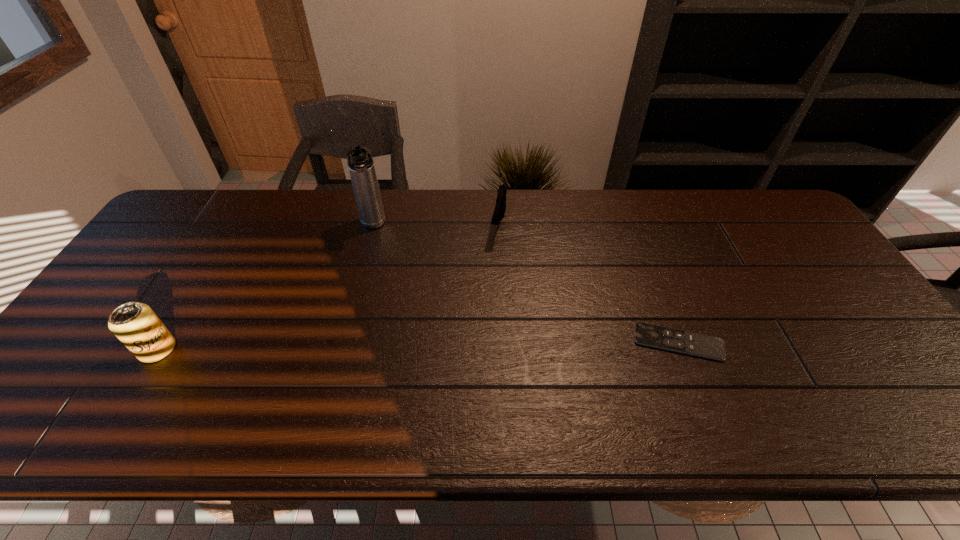
What are the coordinates of `vacant space located 0.120m on the front-facing side of the third object from left to right` in the screenshot? It's located at (492, 274).

Locate an element on the screen. vacant region located 0.100m on the front-facing side of the third object from left to right is located at coordinates (492, 269).

Image resolution: width=960 pixels, height=540 pixels. I want to click on free region located 0.120m on the front-facing side of the third object from left to right, so click(492, 274).

Where is `vacant position located 0.080m on the handle side of the tallest object`? The image size is (960, 540). vacant position located 0.080m on the handle side of the tallest object is located at coordinates point(375,254).

Identify the location of vacant space located 0.400m on the handle side of the tallest object. (388, 340).

You are a GUI agent. You are given a task and a screenshot of the screen. Output one action in this format:
    pyautogui.click(x=<x>, y=<y>)
    Task: Click on the vacant point located on the handle side of the tallest object
    
    Given the screenshot: What is the action you would take?
    pyautogui.click(x=386, y=330)

Find the location of a particular element. Image resolution: width=960 pixels, height=540 pixels. pistol that is at the far edge is located at coordinates 500,207.

Find the location of `thermos bottle that is at the far edge`. thermos bottle that is at the far edge is located at coordinates (361, 166).

You are a GUI agent. You are given a task and a screenshot of the screen. Output one action in this format:
    pyautogui.click(x=<x>, y=<y>)
    Task: Click on the object that is at the near edge
    
    Given the screenshot: What is the action you would take?
    pyautogui.click(x=135, y=324)

You are a GUI agent. You are given a task and a screenshot of the screen. Output one action in this format:
    pyautogui.click(x=<x>, y=<y>)
    Task: Click on the free space at the far edge of the desktop
    The width and height of the screenshot is (960, 540).
    Given the screenshot: What is the action you would take?
    pyautogui.click(x=455, y=194)